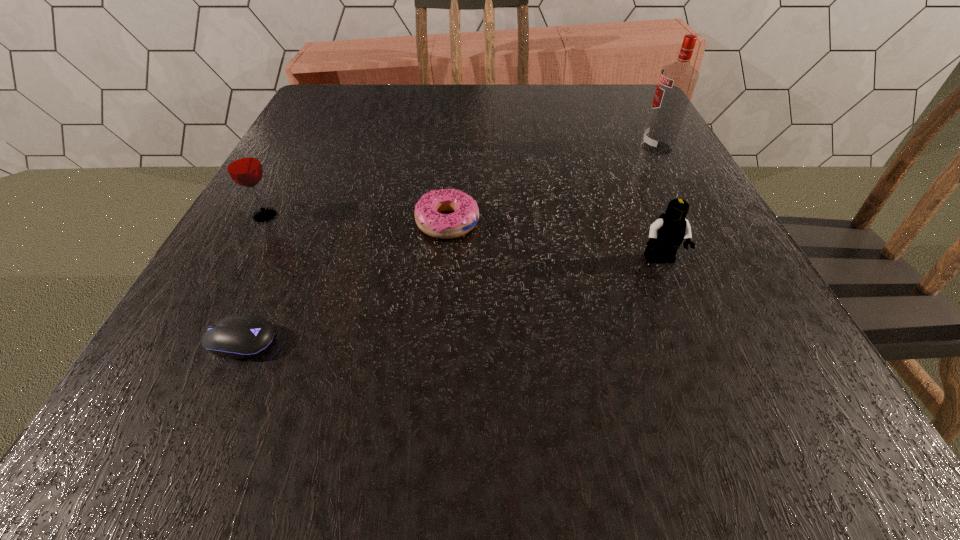
Find the location of a particular element. vacant point located on the front label of the farthest object is located at coordinates (516, 148).

The width and height of the screenshot is (960, 540). What are the coordinates of `vacant region located on the front label of the farthest object` in the screenshot? It's located at (573, 148).

Where is `free point located 0.150m on the back of the glass`? free point located 0.150m on the back of the glass is located at coordinates (295, 161).

At what (x,y) coordinates should I click in order to perform the action: click on free spot located on the front-facing side of the Lego. Please return your answer as a coordinate pair (x, y). Image resolution: width=960 pixels, height=540 pixels. Looking at the image, I should click on (694, 345).

You are a GUI agent. You are given a task and a screenshot of the screen. Output one action in this format:
    pyautogui.click(x=<x>, y=<y>)
    Task: Click on the free space located on the front of the third object from right to left
    
    Given the screenshot: What is the action you would take?
    pyautogui.click(x=440, y=322)

You are a GUI agent. You are given a task and a screenshot of the screen. Output one action in this format:
    pyautogui.click(x=<x>, y=<y>)
    Task: Click on the vacant space located 0.370m on the right of the shortest object
    The image size is (960, 540).
    Given the screenshot: What is the action you would take?
    pyautogui.click(x=557, y=341)

Locate an element on the screen. glass positioned at the left edge is located at coordinates (242, 163).

Where is `computer mouse that is at the left edge`? Image resolution: width=960 pixels, height=540 pixels. computer mouse that is at the left edge is located at coordinates (238, 336).

Identify the location of vodka present at the right edge. This screenshot has width=960, height=540. (677, 81).

Where is `Lego located in the right edge section of the desktop`? This screenshot has width=960, height=540. Lego located in the right edge section of the desktop is located at coordinates (666, 234).